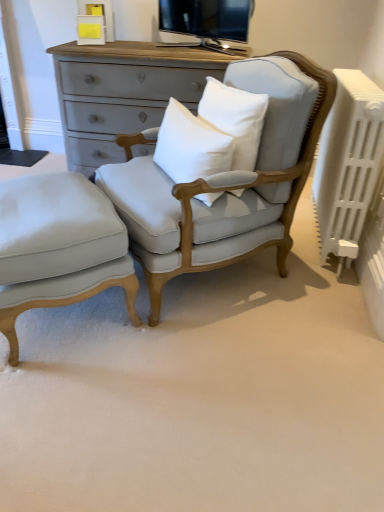
Question: Is white cotton pillow at center, the 2th pillow in the right-to-left sequence, taller than light gray fabric ottoman at lower left?

Choices:
 (A) yes
 (B) no

Answer: (B)

Question: Does white cotton pillow at center, the first pillow in the left-to-right sequence, have a smaller size compared to light gray fabric ottoman at lower left?

Choices:
 (A) no
 (B) yes

Answer: (B)

Question: From the image's perspective, is white cotton pillow at center, the 2th pillow in the right-to-left sequence, beneath light gray fabric ottoman at lower left?

Choices:
 (A) yes
 (B) no

Answer: (B)

Question: Is there a large distance between white cotton pillow at center, the first pillow in the left-to-right sequence, and light gray fabric ottoman at lower left?

Choices:
 (A) yes
 (B) no

Answer: (B)

Question: Is white cotton pillow at center, the 2th pillow in the right-to-left sequence, oriented towards light gray fabric ottoman at lower left?

Choices:
 (A) yes
 (B) no

Answer: (B)

Question: Considering the positions of white cotton pillow at center, the first pillow in the left-to-right sequence, and light gray fabric ottoman at lower left in the image, is white cotton pillow at center, the first pillow in the left-to-right sequence, bigger or smaller than light gray fabric ottoman at lower left?

Choices:
 (A) small
 (B) big

Answer: (A)

Question: From a real-world perspective, is white cotton pillow at center, the 2th pillow in the right-to-left sequence, physically located above or below light gray fabric ottoman at lower left?

Choices:
 (A) above
 (B) below

Answer: (A)

Question: Do you think white cotton pillow at center, the first pillow in the left-to-right sequence, is within light gray fabric ottoman at lower left, or outside of it?

Choices:
 (A) inside
 (B) outside

Answer: (B)

Question: Is white cotton pillow at center, the first pillow in the left-to-right sequence, wider or thinner than light gray fabric ottoman at lower left?

Choices:
 (A) wide
 (B) thin

Answer: (B)

Question: From a real-world perspective, is white cotton pillow at center, the 2th pillow in the right-to-left sequence, positioned above or below light gray fabric chair at center?

Choices:
 (A) below
 (B) above

Answer: (B)

Question: Is white cotton pillow at center, the first pillow in the left-to-right sequence, taller or shorter than light gray fabric chair at center?

Choices:
 (A) short
 (B) tall

Answer: (A)

Question: Would you say white cotton pillow at center, the 2th pillow in the right-to-left sequence, is inside or outside light gray fabric chair at center?

Choices:
 (A) inside
 (B) outside

Answer: (A)

Question: Considering their positions, is white cotton pillow at center, the 2th pillow in the right-to-left sequence, located in front of or behind light gray fabric chair at center?

Choices:
 (A) behind
 (B) front

Answer: (A)

Question: Is light gray fabric ottoman at lower left bigger or smaller than white plastic radiator at right?

Choices:
 (A) big
 (B) small

Answer: (A)

Question: From the image's perspective, relative to white plastic radiator at right, is light gray fabric ottoman at lower left above or below?

Choices:
 (A) above
 (B) below

Answer: (B)